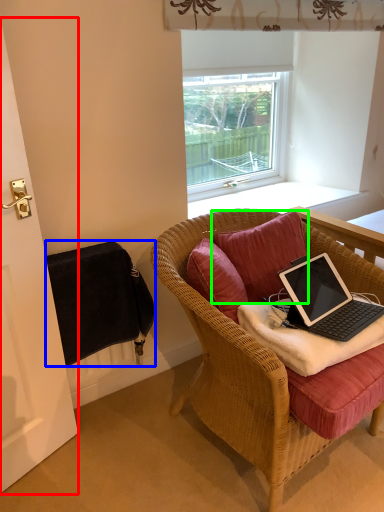
Question: Estimate the real-world distances between objects in this image. Which object is farther from screen door (highlighted by a red box), radiator (highlighted by a blue box) or pillow (highlighted by a green box)?

Choices:
 (A) radiator
 (B) pillow

Answer: (B)